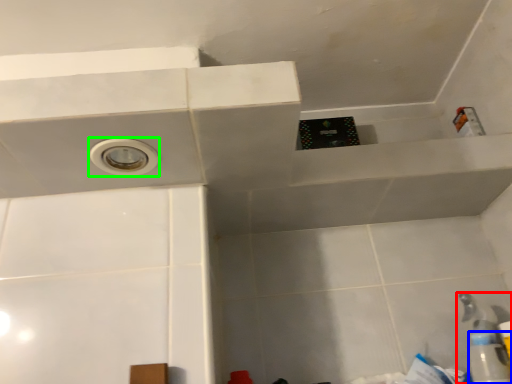
Question: Which is nearer to the plumbing fixture (highlighted by a red box)? bottle (highlighted by a blue box) or hole (highlighted by a green box).

Choices:
 (A) bottle
 (B) hole

Answer: (A)